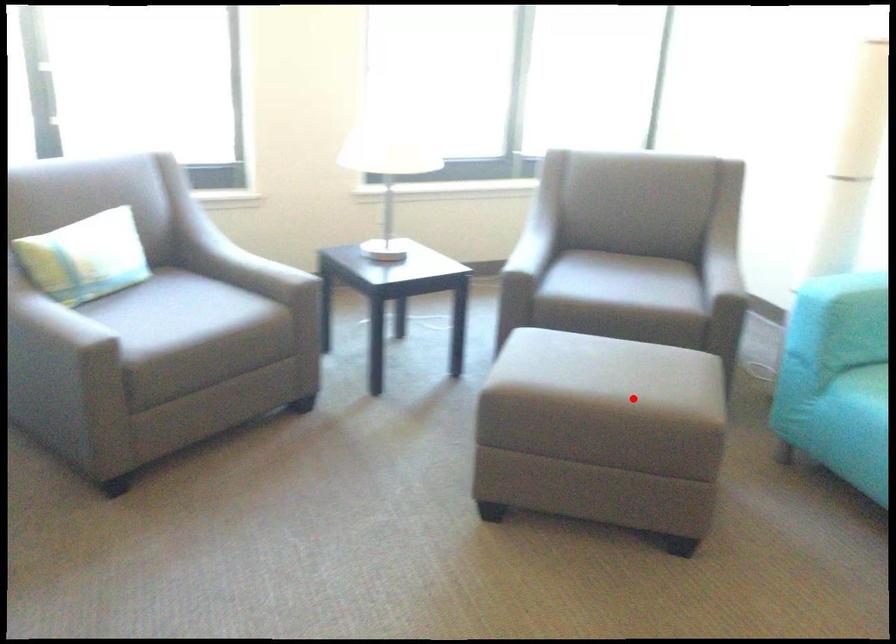
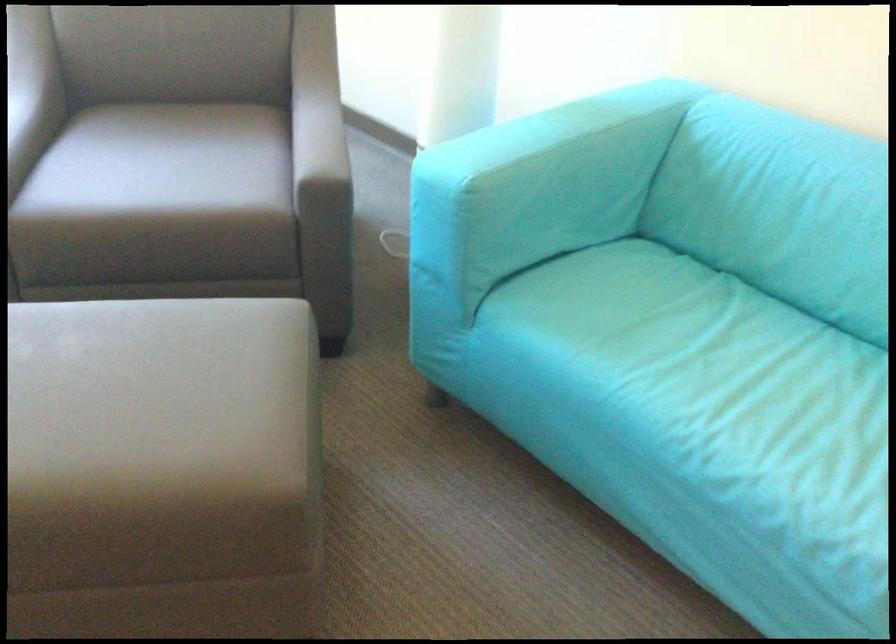
Question: I am providing you with two images of the same scene from different viewpoints. A red point is marked on the first image. At the location where the point appears in image 1, is it still visible in image 2?

Choices:
 (A) Yes
 (B) No

Answer: (A)